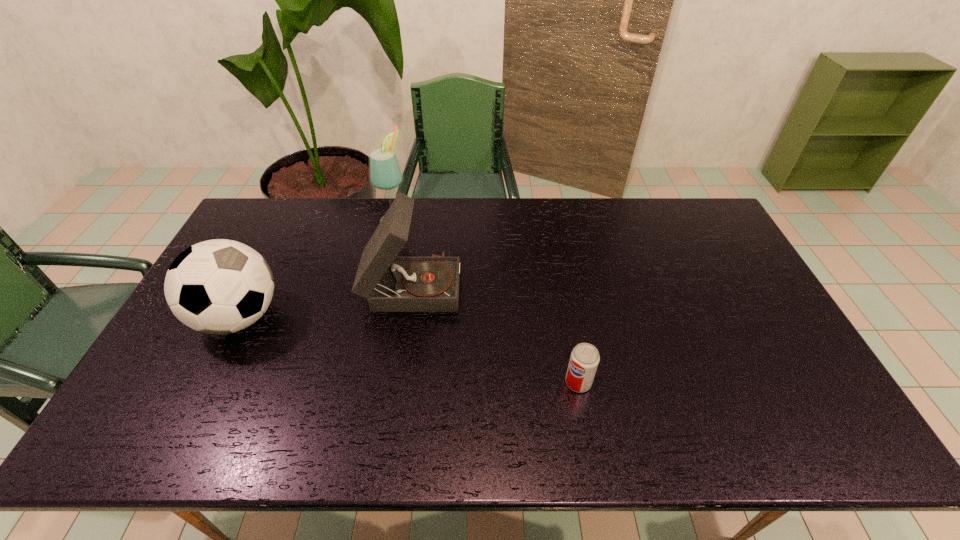
At what (x,y) coordinates should I click in order to perform the action: click on vacant space that satisfies the following two spatial constraints: 1. on the front-facing side of the phonograph_record; 2. on the right side of the nearest object. Please return your answer as a coordinate pair (x, y). Looking at the image, I should click on (396, 382).

Find the location of `vacant area that satisfies the following two spatial constraints: 1. on the main logo of the leftmost object; 2. on the back side of the nearest object`. vacant area that satisfies the following two spatial constraints: 1. on the main logo of the leftmost object; 2. on the back side of the nearest object is located at coordinates (207, 382).

The width and height of the screenshot is (960, 540). What are the coordinates of `vacant region that satisfies the following two spatial constraints: 1. on the front side of the farthest object; 2. on the right side of the shortest object` in the screenshot? It's located at (358, 382).

Locate an element on the screen. The image size is (960, 540). vacant space that satisfies the following two spatial constraints: 1. on the main logo of the soccer ball; 2. on the back side of the shortest object is located at coordinates (207, 382).

You are a GUI agent. You are given a task and a screenshot of the screen. Output one action in this format:
    pyautogui.click(x=<x>, y=<y>)
    Task: Click on the vacant point that satisfies the following two spatial constraints: 1. on the main logo of the leftmost object; 2. on the right side of the soda
    This screenshot has height=540, width=960.
    Given the screenshot: What is the action you would take?
    pyautogui.click(x=207, y=382)